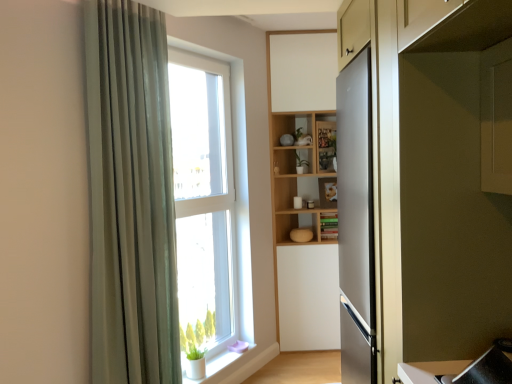
Question: Can we say clear glass window at center lies outside satin silver refrigerator at right?

Choices:
 (A) yes
 (B) no

Answer: (A)

Question: From the image's perspective, does clear glass window at center appear higher than satin silver refrigerator at right?

Choices:
 (A) yes
 (B) no

Answer: (B)

Question: Does clear glass window at center have a lesser width compared to satin silver refrigerator at right?

Choices:
 (A) no
 (B) yes

Answer: (B)

Question: Is clear glass window at center at the left side of satin silver refrigerator at right?

Choices:
 (A) no
 (B) yes

Answer: (B)

Question: Is clear glass window at center wider than satin silver refrigerator at right?

Choices:
 (A) yes
 (B) no

Answer: (B)

Question: Is clear glass window at center shorter than satin silver refrigerator at right?

Choices:
 (A) yes
 (B) no

Answer: (B)

Question: Is white matte window sill at lower left surrounding clear glass window at center?

Choices:
 (A) yes
 (B) no

Answer: (B)

Question: From the image's perspective, is white matte window sill at lower left over clear glass window at center?

Choices:
 (A) yes
 (B) no

Answer: (B)

Question: Is white matte window sill at lower left not within clear glass window at center?

Choices:
 (A) yes
 (B) no

Answer: (A)

Question: Considering the relative sizes of white matte window sill at lower left and clear glass window at center in the image provided, is white matte window sill at lower left wider than clear glass window at center?

Choices:
 (A) yes
 (B) no

Answer: (A)

Question: Is white matte window sill at lower left looking in the opposite direction of clear glass window at center?

Choices:
 (A) yes
 (B) no

Answer: (B)

Question: Are white matte window sill at lower left and clear glass window at center located far from each other?

Choices:
 (A) yes
 (B) no

Answer: (B)

Question: Considering the relative positions of green fabric curtain at left and white matte window sill at lower left in the image provided, is green fabric curtain at left to the right of white matte window sill at lower left from the viewer's perspective?

Choices:
 (A) no
 (B) yes

Answer: (A)